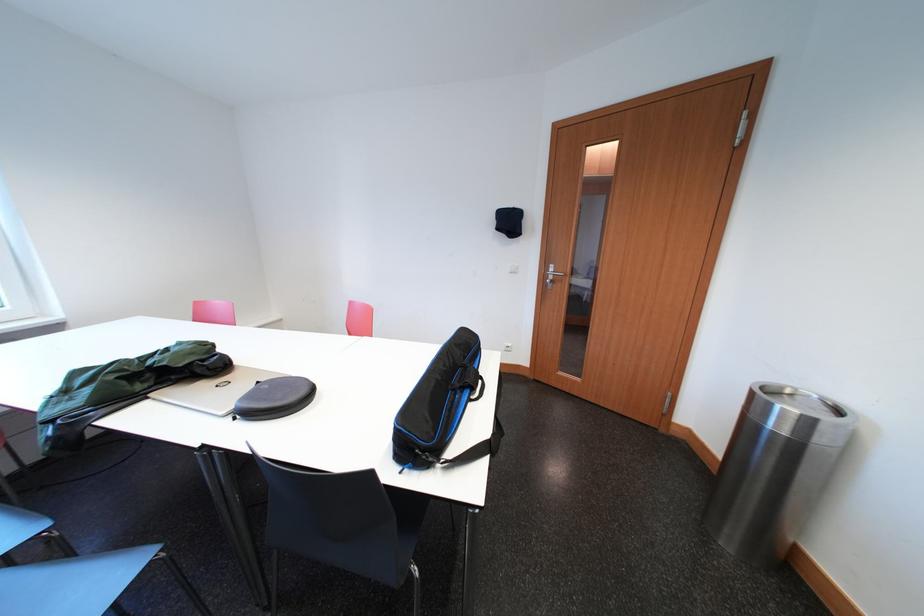
Describe the element at coordinates (71, 583) in the screenshot. I see `a black chair sitting surface` at that location.